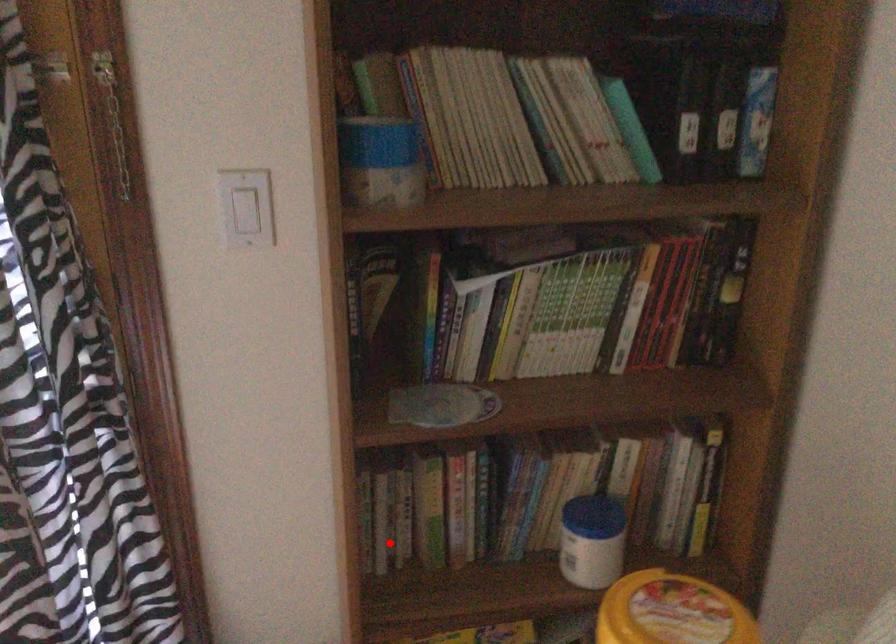
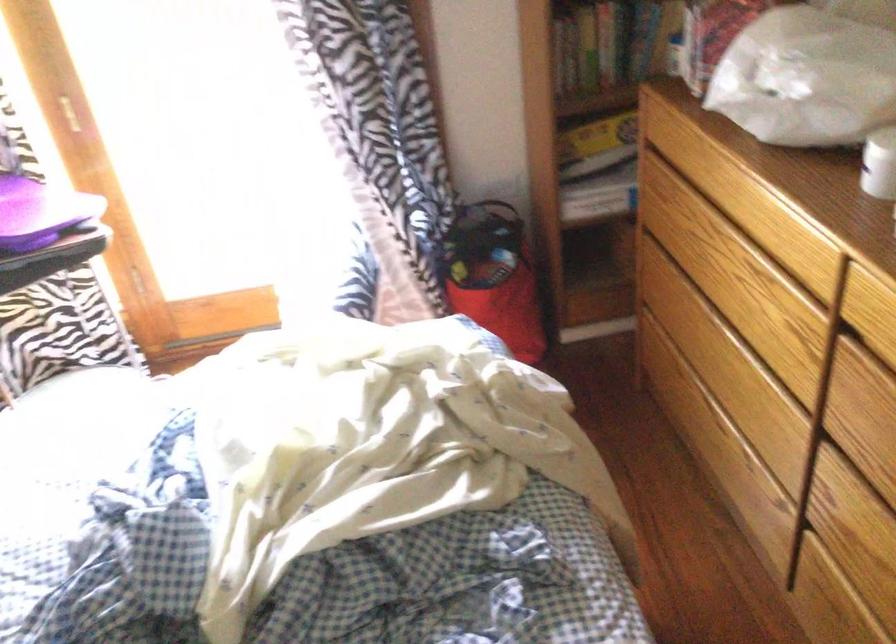
Question: I am providing you with two images of the same scene from different viewpoints. Given a red point in image1, look at the same physical point in image2. Is it:

Choices:
 (A) Closer to the viewpoint
 (B) Farther from the viewpoint

Answer: (B)